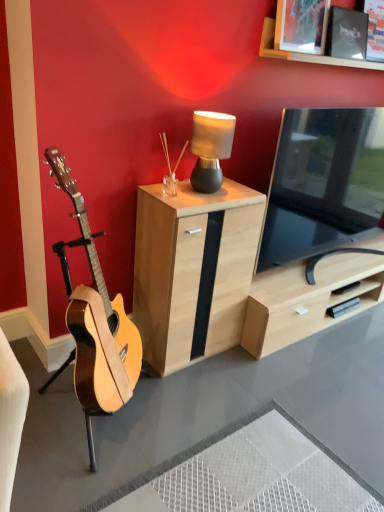
Question: From the image's perspective, is black glossy tv at right positioned above or below natural wood guitar at left?

Choices:
 (A) above
 (B) below

Answer: (A)

Question: From a real-world perspective, is black glossy tv at right above or below natural wood guitar at left?

Choices:
 (A) above
 (B) below

Answer: (A)

Question: Which object is positioned closest to the matte black lamp at center?

Choices:
 (A) black glossy tv at right
 (B) wooden picture frame at upper right, the 2th picture frame positioned from the right
 (C) natural wood guitar at left
 (D) light wood cabinet at center
 (E) matte black picture frame at upper right, which appears as the first picture frame when viewed from the right

Answer: (D)

Question: Considering the real-world distances, which object is closest to the natural wood guitar at left?

Choices:
 (A) matte black lamp at center
 (B) wooden picture frame at upper right, which ranks as the first picture frame in left-to-right order
 (C) matte black picture frame at upper right, which appears as the first picture frame when viewed from the right
 (D) light wood cabinet at center
 (E) black glossy tv at right

Answer: (D)